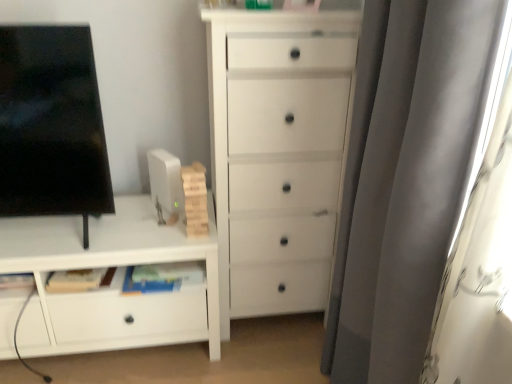
Question: Does point (396, 49) appear closer or farther from the camera than point (238, 102)?

Choices:
 (A) closer
 (B) farther

Answer: (A)

Question: From the image's perspective, is gray velvet curtain at right located above or below white matte chest of drawers at center, the 1th chest of drawers from the right?

Choices:
 (A) above
 (B) below

Answer: (B)

Question: Considering the real-world distances, which object is closest to the white matte cabinet at lower left, which ranks as the 1th chest of drawers in left-to-right order?

Choices:
 (A) gray velvet curtain at right
 (B) white matte chest of drawers at center, the 1th chest of drawers from the right
 (C) black glossy screen at left

Answer: (C)

Question: Which of these objects is positioned closest to the gray velvet curtain at right?

Choices:
 (A) white matte cabinet at lower left, the second chest of drawers viewed from the right
 (B) black glossy screen at left
 (C) white matte chest of drawers at center, the 1th chest of drawers from the right

Answer: (C)